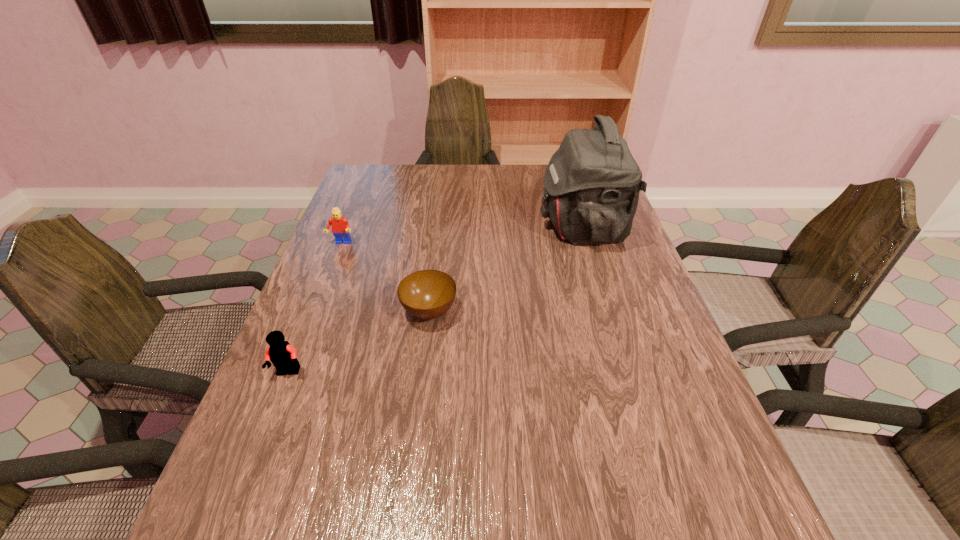
Locate an element on the screen. vacant space that satisfies the following two spatial constraints: 1. on the open flap of the tallest object; 2. on the front-facing side of the nearest object is located at coordinates (628, 373).

Identify the location of free space in the image that satisfies the following two spatial constraints: 1. on the open flap of the shoulder bag; 2. on the front-facing side of the nearer Lego. (628, 373).

Locate an element on the screen. free space that satisfies the following two spatial constraints: 1. on the front-facing side of the second nearest object; 2. on the left side of the farther Lego is located at coordinates (314, 312).